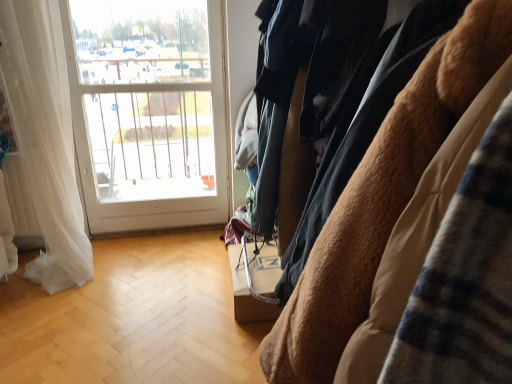
Question: Does white glass window at upper left have a larger size compared to brown fuzzy coat at right?

Choices:
 (A) no
 (B) yes

Answer: (A)

Question: From the image's perspective, is white glass window at upper left above brown fuzzy coat at right?

Choices:
 (A) no
 (B) yes

Answer: (B)

Question: Can you confirm if white glass window at upper left is thinner than brown fuzzy coat at right?

Choices:
 (A) yes
 (B) no

Answer: (A)

Question: Does white glass window at upper left turn towards brown fuzzy coat at right?

Choices:
 (A) no
 (B) yes

Answer: (B)

Question: Can you confirm if white glass window at upper left is taller than brown fuzzy coat at right?

Choices:
 (A) no
 (B) yes

Answer: (B)

Question: Is white glass window at upper left positioned behind brown fuzzy coat at right?

Choices:
 (A) yes
 (B) no

Answer: (A)

Question: Can white sheer curtain at left be found inside white glass window at upper left?

Choices:
 (A) no
 (B) yes

Answer: (A)

Question: Can you confirm if white glass window at upper left is bigger than white sheer curtain at left?

Choices:
 (A) no
 (B) yes

Answer: (A)

Question: Considering the relative sizes of white glass window at upper left and white sheer curtain at left in the image provided, is white glass window at upper left thinner than white sheer curtain at left?

Choices:
 (A) no
 (B) yes

Answer: (B)

Question: From the image's perspective, is white glass window at upper left on white sheer curtain at left?

Choices:
 (A) no
 (B) yes

Answer: (B)

Question: Is white glass window at upper left closer to the viewer compared to white sheer curtain at left?

Choices:
 (A) yes
 (B) no

Answer: (B)

Question: Considering the relative sizes of white glass window at upper left and white sheer curtain at left in the image provided, is white glass window at upper left taller than white sheer curtain at left?

Choices:
 (A) no
 (B) yes

Answer: (B)

Question: Considering the relative sizes of brown fuzzy coat at right and white glass window at upper left in the image provided, is brown fuzzy coat at right taller than white glass window at upper left?

Choices:
 (A) no
 (B) yes

Answer: (A)